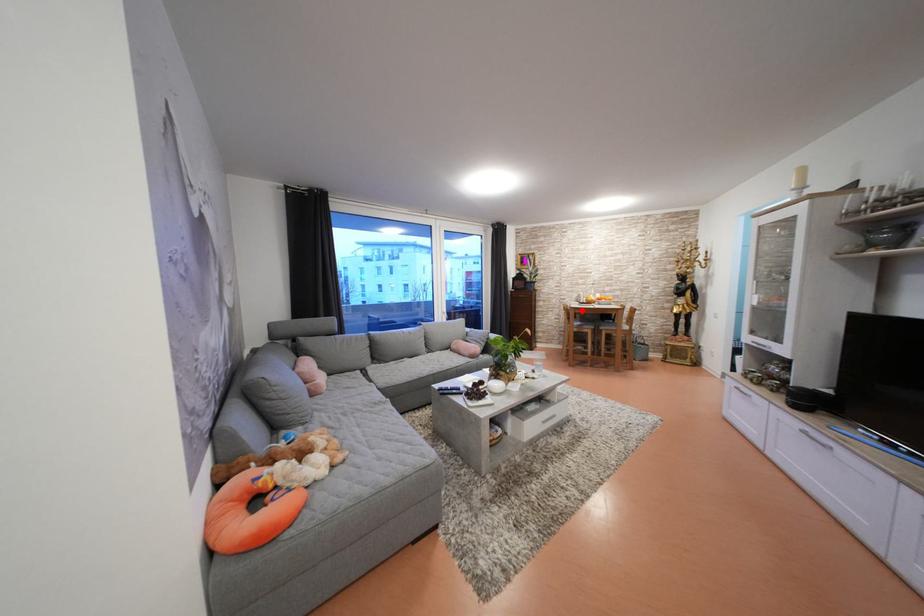
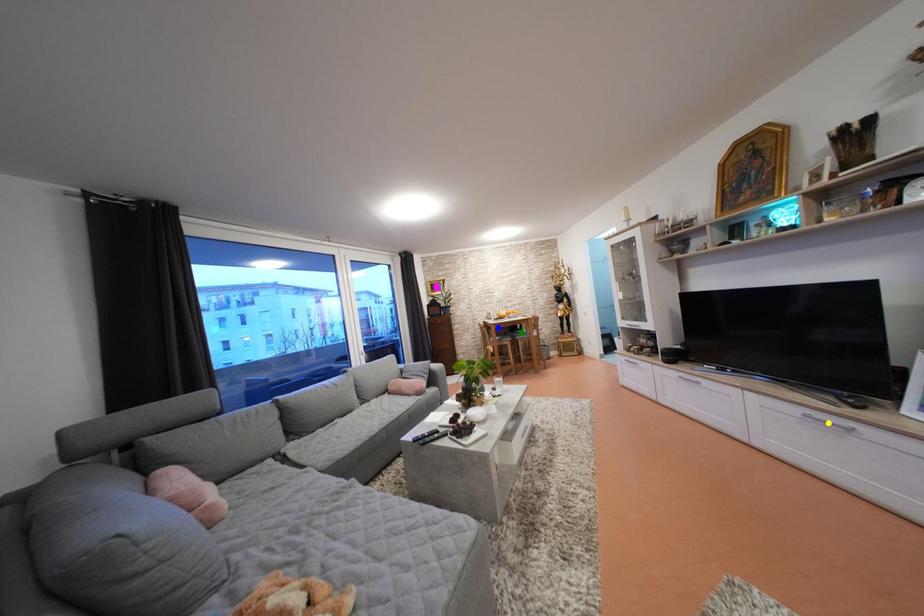
Question: I am providing you with two images of the same scene from different viewpoints. A red point is marked on the first image. You are given multiple points on the second image. Can you choose the point in image 2 that corresponds to the point in image 1?

Choices:
 (A) yellow point
 (B) green point
 (C) blue point

Answer: (C)